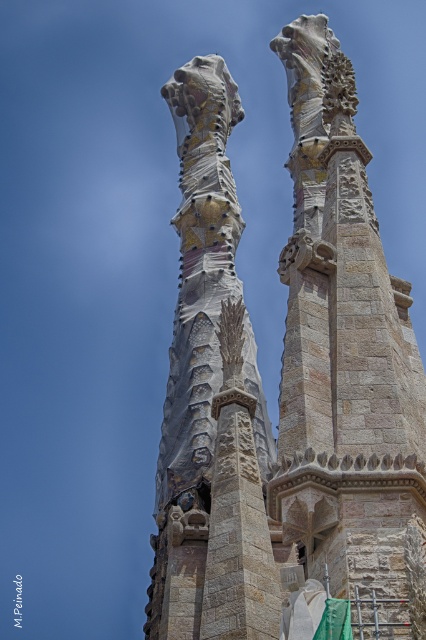
You are an architect examining the Sagrada Familia spires. You notice the stone textured spire at center and the stone textured column at center. Which structure is larger in size?

The stone textured spire at center is bigger than the stone textured column at center, so the spire is larger in size.

You are standing in front of the historic building and want to take a photo of both the stone textured spire at center and the stone textured column at center. Which one should you focus on first to ensure both are in clear view?

You should focus on the stone textured spire at center first because it is closer to you than the stone textured column at center, allowing both to be in focus when adjusting the camera settings accordingly.